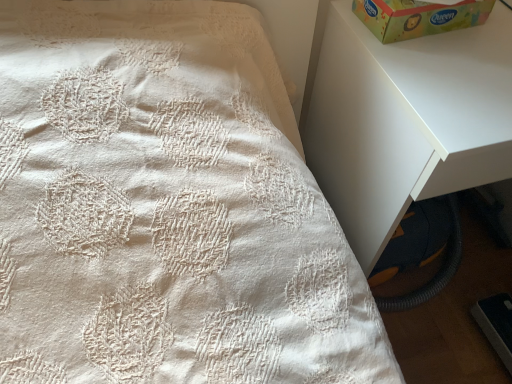
Identify the location of vacant space in green paperboard box at upper right (from a real-world perspective). (432, 31).